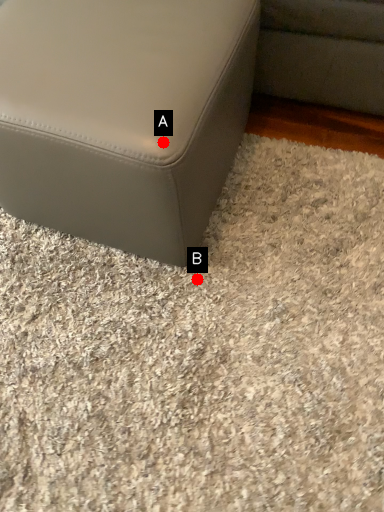
Question: Two points are circled on the image, labeled by A and B beside each circle. Which point is closer to the camera taking this photo?

Choices:
 (A) A is closer
 (B) B is closer

Answer: (A)